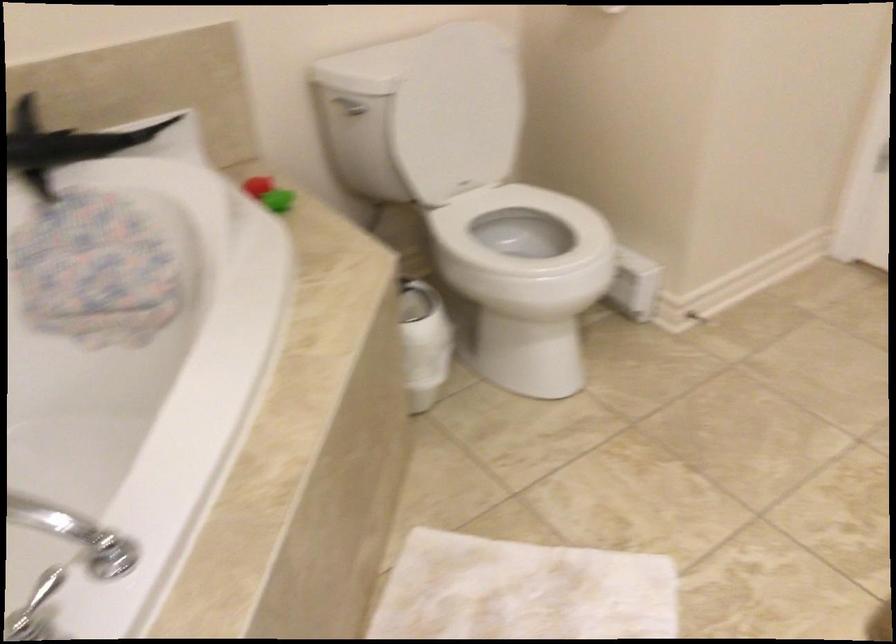
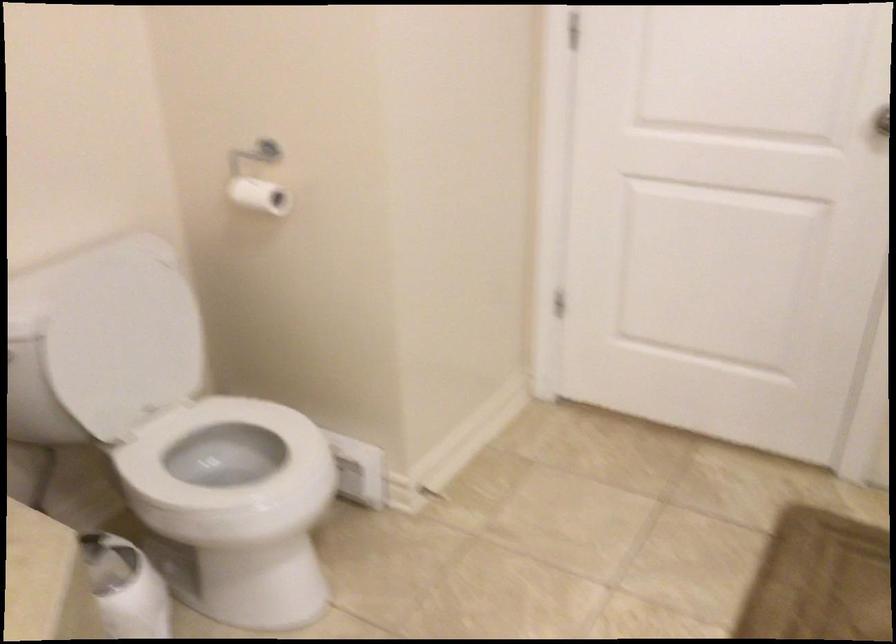
The images are taken continuously from a first-person perspective. In which direction are you moving?

The cameraman walked toward right, forward.